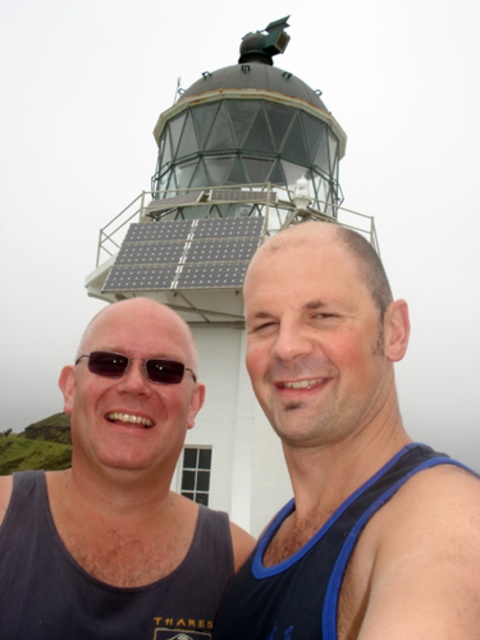
You are a photographer trying to capture a photo of the metallic lighthouse at upper center. However, the black fabric tank top at center is blocking part of the lighthouse. Can you estimate if the lighthouse will still be mostly visible in the photo?

The metallic lighthouse at upper center is larger than the black fabric tank top at center, so most of the lighthouse should still be visible in the photo.

You are standing at the origin point in the image. The metallic lighthouse at upper center is located at point 0.386, 0.473. If you want to walk directly towards the lighthouse, in which direction should you move?

The metallic lighthouse at upper center is located at point (227, 246), so you should move northeast to reach it.

You are standing in front of the lighthouse and want to walk from point A to point B. Point A is at coordinates point (313,417) and point B is at coordinates point (299,150). Since you can only move forward, will you pass through point B before reaching point A?

Point (313,417) is in front of point (299,150). Therefore, if you start at point A and move forward towards point B, you will reach point A before point B. Since you are moving from A to B, you will first arrive at point A and then proceed to point B. However, if you are starting from a position behind both points and moving forward, you would encounter point A first before point B. The question states you want to walk from point A to point B, so you are already at point A. Therefore, you cannot pass